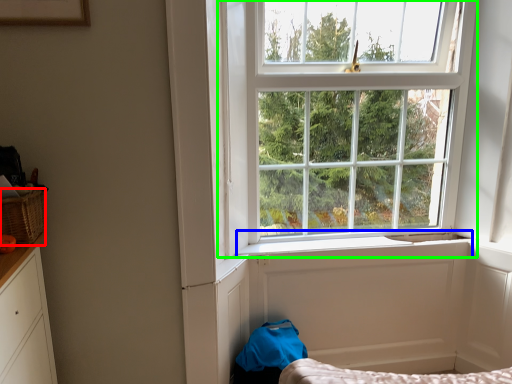
Question: Which is nearer to the basket (highlighted by a red box)? window sill (highlighted by a blue box) or window (highlighted by a green box).

Choices:
 (A) window sill
 (B) window

Answer: (A)